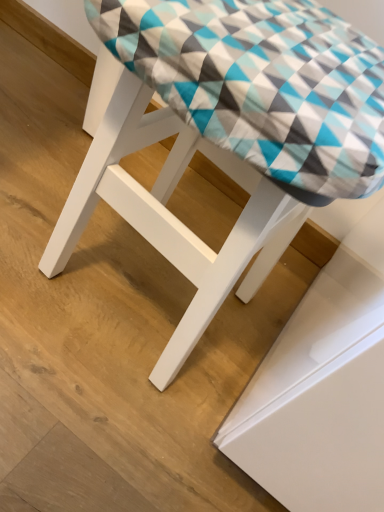
The image size is (384, 512). In order to click on vacant space situated above white matte stool at center (from a real-world perspective) in this screenshot , I will do `click(310, 47)`.